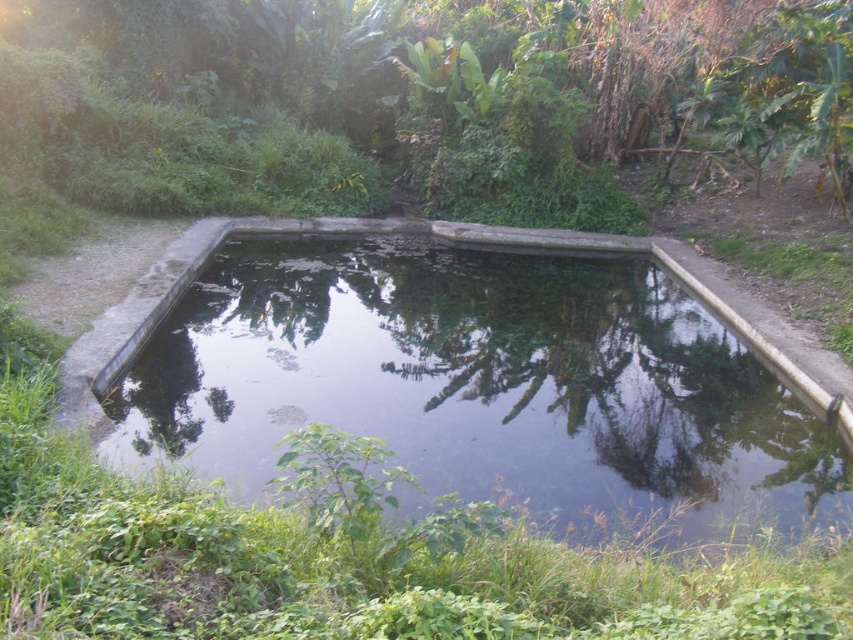
You are a landscape architect designing a garden path that needs to pass between the green leafy tree at center and the concrete pond at center. Considering their widths, which object will require more space on the path?

The green leafy tree at center has a larger width than the concrete pond at center, so it will require more space on the path.

You are standing at the edge of the rectangular water feature and see two points marked in the scene. Which point, point (732, 20) or point (660, 532), is closer to you?

Point (732, 20) is closer to you because it is further to the viewer than point (660, 532).